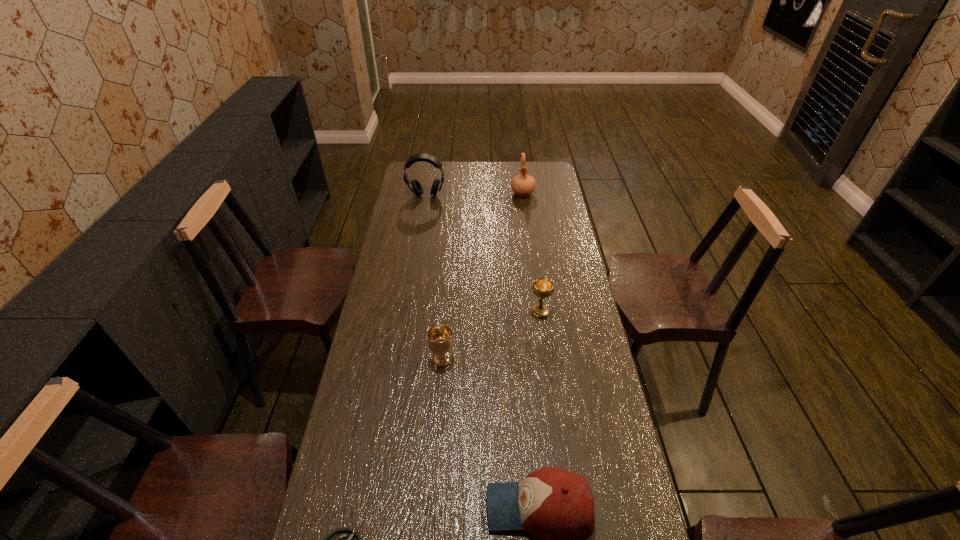
The height and width of the screenshot is (540, 960). I want to click on object located in the left edge section of the desktop, so click(414, 185).

Locate an element on the screen. This screenshot has height=540, width=960. pottery that is at the right edge is located at coordinates (523, 185).

The width and height of the screenshot is (960, 540). I want to click on chalice that is positioned at the right edge, so click(x=542, y=287).

The image size is (960, 540). Identify the location of vacant space at the far edge. (505, 180).

The height and width of the screenshot is (540, 960). In order to click on vacant region at the left edge of the desktop in this screenshot , I will do `click(391, 288)`.

Identify the location of vacant space at the right edge of the desktop. The height and width of the screenshot is (540, 960). (561, 236).

You are a GUI agent. You are given a task and a screenshot of the screen. Output one action in this format:
    pyautogui.click(x=<x>, y=<y>)
    Task: Click on the free location at the far left corner
    This screenshot has width=960, height=540.
    Given the screenshot: What is the action you would take?
    pyautogui.click(x=420, y=162)

Locate an element on the screen. free space between the pottery and the farther chalice is located at coordinates (532, 253).

Locate an element on the screen. free space between the pottery and the farther chalice is located at coordinates (532, 253).

I want to click on free spot between the left chalice and the earphone, so click(434, 278).